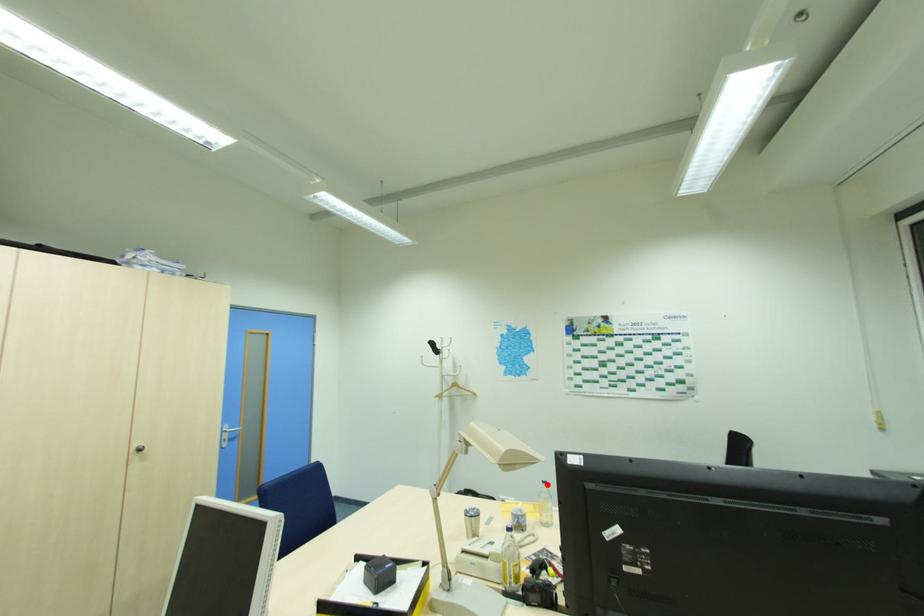
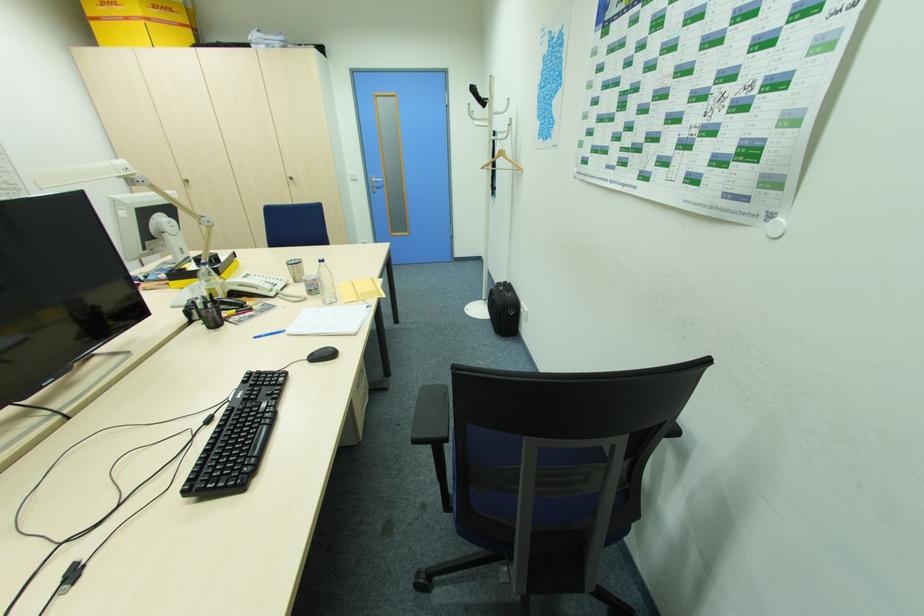
Question: I am providing you with two images of the same scene from different viewpoints. Given a red point in image1, look at the same physical point in image2. Is it:

Choices:
 (A) Closer to the viewpoint
 (B) Farther from the viewpoint

Answer: (A)